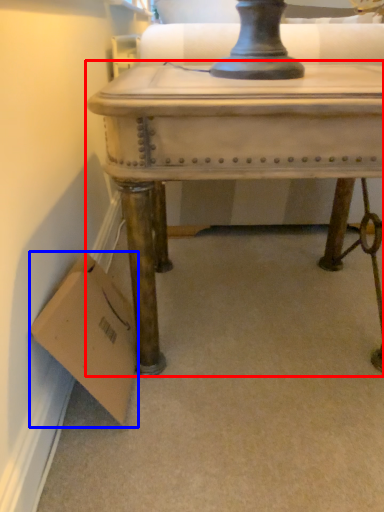
Question: Which point is further to the camera, table (highlighted by a red box) or cardboard box (highlighted by a blue box)?

Choices:
 (A) table
 (B) cardboard box

Answer: (B)